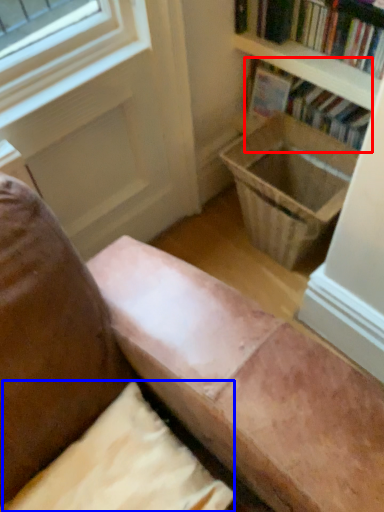
Question: Which object appears farthest to the camera in this image, book (highlighted by a red box) or pillow (highlighted by a blue box)?

Choices:
 (A) book
 (B) pillow

Answer: (A)